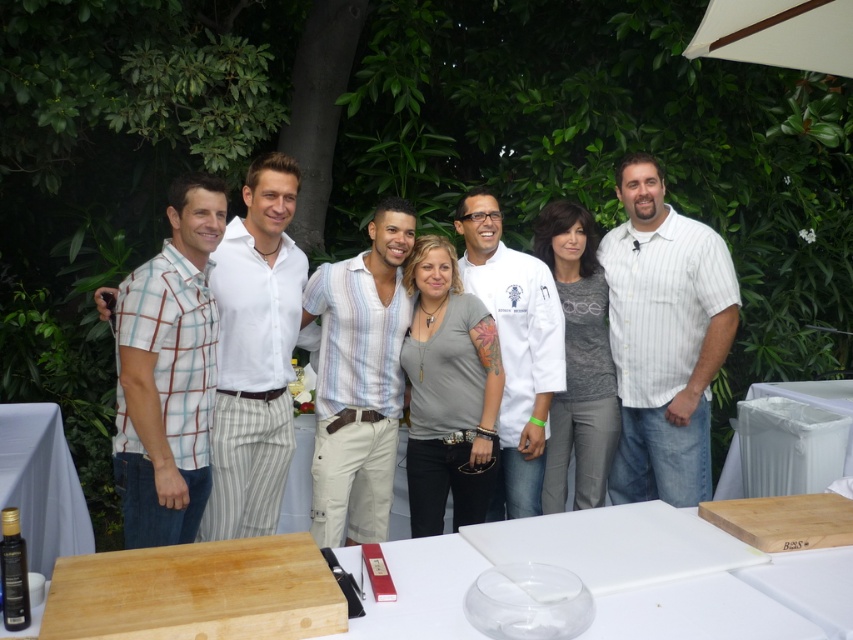
You are standing in the garden where the group is posing. You need to place a new decorative item exactly at the point where the wooden cutting board at lower center is located. What are the coordinates of this point?

The wooden cutting board at lower center is located at point (624, 577).

In the scene shown: In the group photo, there are two people wearing cotton shirts at the center. The striped cotton shirt at center and the gray cotton shirt at center. Which one is positioned to the left?

The striped cotton shirt at center is to the left of the gray cotton shirt at center.

You are at a social gathering in a garden and notice two people wearing white chef coat at center and gray cotton shirt at center. Which one is positioned to the left?

The white chef coat at center is to the left of the gray cotton shirt at center.